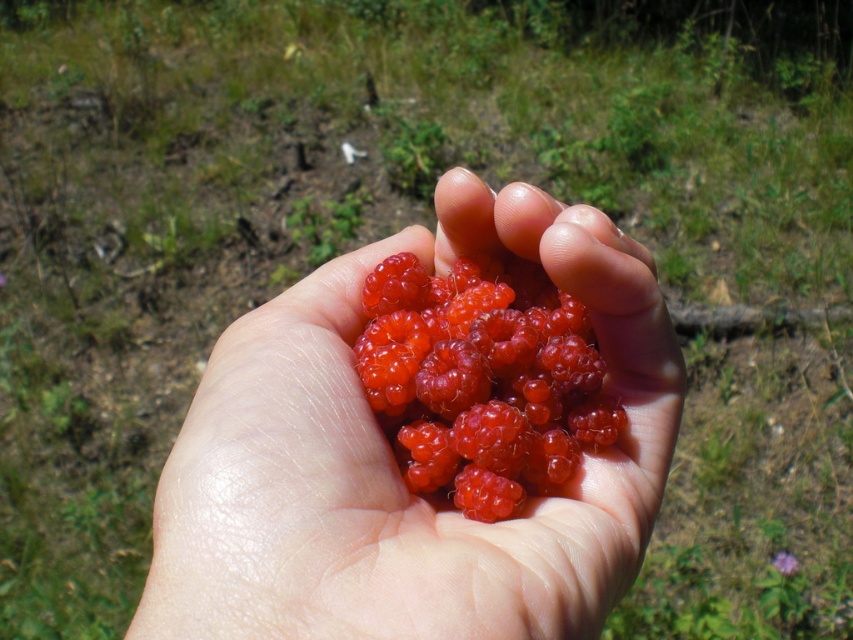
Image resolution: width=853 pixels, height=640 pixels. What do you see at coordinates (395, 465) in the screenshot?
I see `glossy red raspberries at center` at bounding box center [395, 465].

Which of these two, glossy red raspberries at center or shiny red berries at center, stands taller?

glossy red raspberries at center

Where is `glossy red raspberries at center`? This screenshot has width=853, height=640. glossy red raspberries at center is located at coordinates (395, 465).